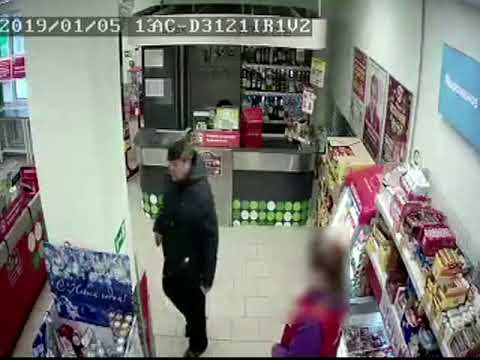
Where is `background white wall`? The height and width of the screenshot is (360, 480). background white wall is located at coordinates (466, 206), (425, 137), (435, 36), (466, 17), (392, 15), (344, 19), (411, 62).